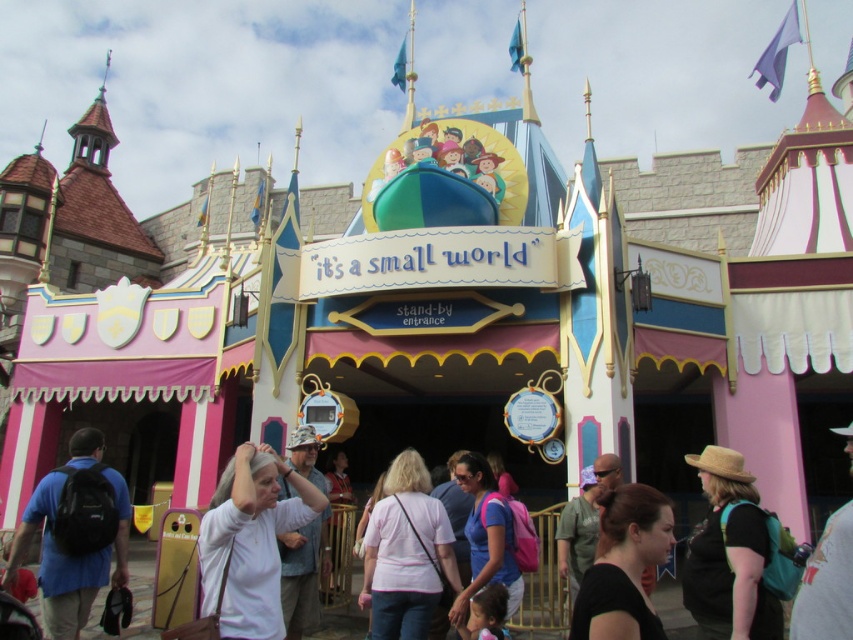
Question: Does pink fabric shirt at center come in front of black fabric at center?

Choices:
 (A) yes
 (B) no

Answer: (B)

Question: Among these objects, which one is nearest to the camera?

Choices:
 (A) matte blue shirt at center
 (B) straw hat at center
 (C) blue fabric backpack at left

Answer: (B)

Question: Considering the real-world distances, which object is closest to the pink fabric shirt at center?

Choices:
 (A) white matte shirt at center
 (B) pink fabric hat at upper center

Answer: (A)

Question: Is blue fabric backpack at left further to camera compared to pink fabric shirt at center?

Choices:
 (A) no
 (B) yes

Answer: (A)

Question: Considering the real-world distances, which object is closest to the pink fabric shirt at center?

Choices:
 (A) matte blue shirt at center
 (B) pink fabric hat at upper center
 (C) white matte shirt at center
 (D) blue fabric backpack at left

Answer: (A)

Question: Is blue fabric backpack at left below matte blue shirt at center?

Choices:
 (A) yes
 (B) no

Answer: (A)